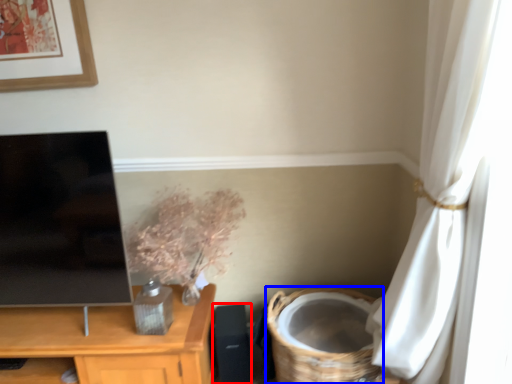
Question: Which point is further to the camera, speaker (highlighted by a red box) or basket (highlighted by a blue box)?

Choices:
 (A) speaker
 (B) basket

Answer: (A)